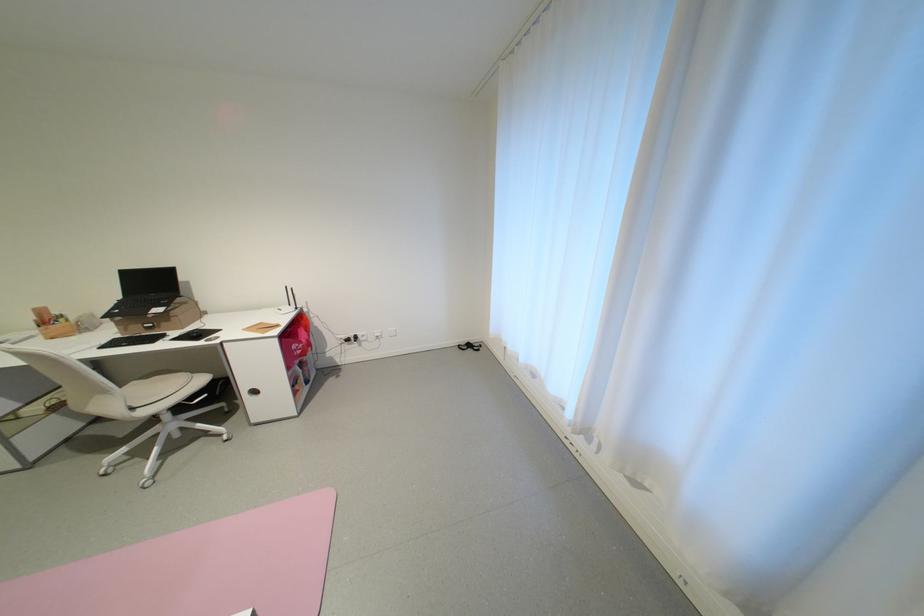
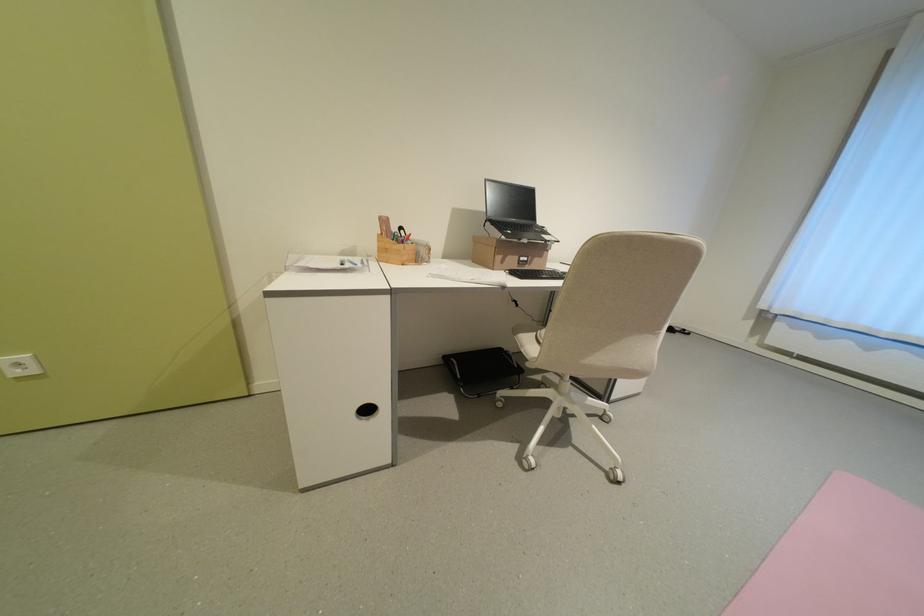
Locate, in the second image, the point that corresponds to point (161, 326) in the first image.

(536, 261)